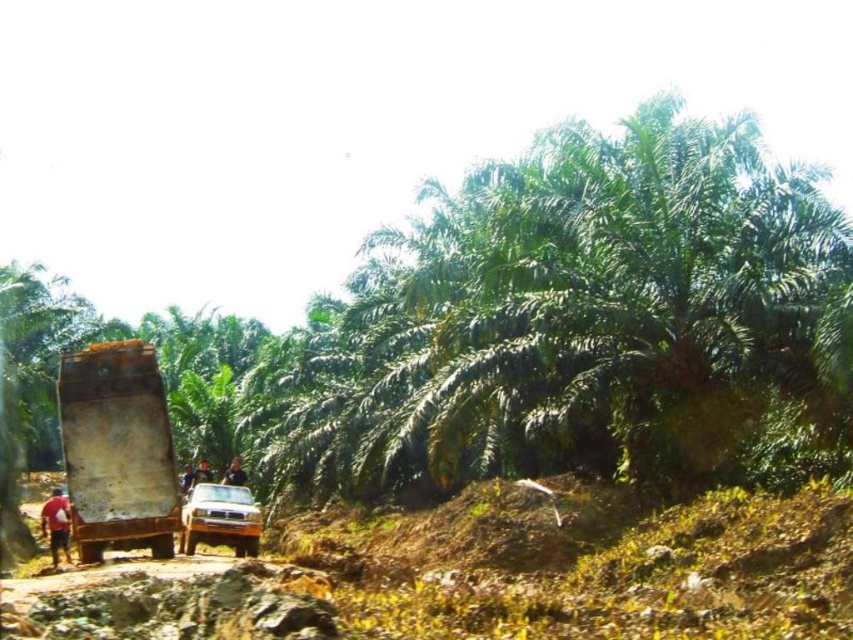
Question: Does metallic silver suv at center appear over red fabric shirt at lower left?

Choices:
 (A) no
 (B) yes

Answer: (B)

Question: Does rusty metal truck at center appear under blue fabric shirt at center?

Choices:
 (A) yes
 (B) no

Answer: (B)

Question: Considering the real-world distances, which object is closest to the blue fabric shirt at center?

Choices:
 (A) red fabric shirt at lower left
 (B) dark blue shirt at center

Answer: (B)

Question: Which object is closer to the camera taking this photo?

Choices:
 (A) dark blue shirt at center
 (B) blue fabric shirt at center

Answer: (A)

Question: Can you confirm if dark blue shirt at center is positioned above blue fabric shirt at center?

Choices:
 (A) yes
 (B) no

Answer: (A)

Question: Which is farther from the blue fabric shirt at center?

Choices:
 (A) red fabric shirt at lower left
 (B) rusty metal truck at center

Answer: (B)